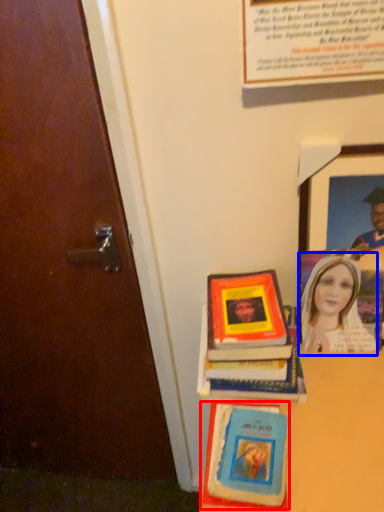
Question: Which point is closer to the camera, book cover (highlighted by a red box) or woman (highlighted by a blue box)?

Choices:
 (A) book cover
 (B) woman

Answer: (A)